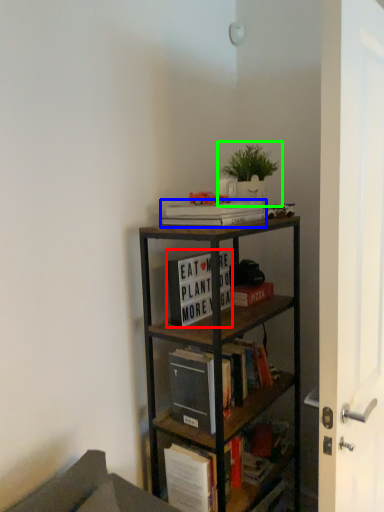
Question: Which object is the closest to the book (highlighted by a red box)? Choose among these: book (highlighted by a blue box) or houseplant (highlighted by a green box).

Choices:
 (A) book
 (B) houseplant

Answer: (A)